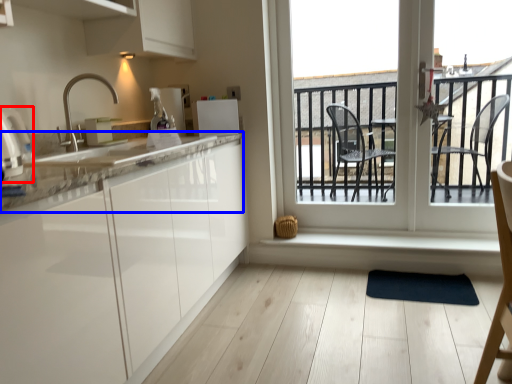
Question: Which object appears closest to the camera in this image, appliance (highlighted by a red box) or countertop (highlighted by a blue box)?

Choices:
 (A) appliance
 (B) countertop

Answer: (A)